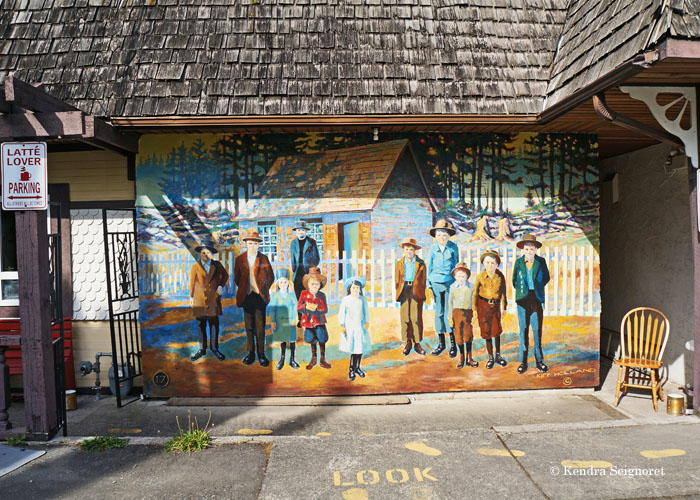
This screenshot has width=700, height=500. Find the location of `window`. window is located at coordinates (8, 281).